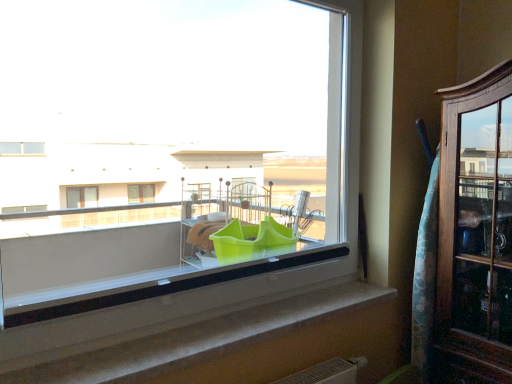
Where is `vacant space situated above smooth concrete window sill at center (from a real-world perspective)`? vacant space situated above smooth concrete window sill at center (from a real-world perspective) is located at coordinates (246, 323).